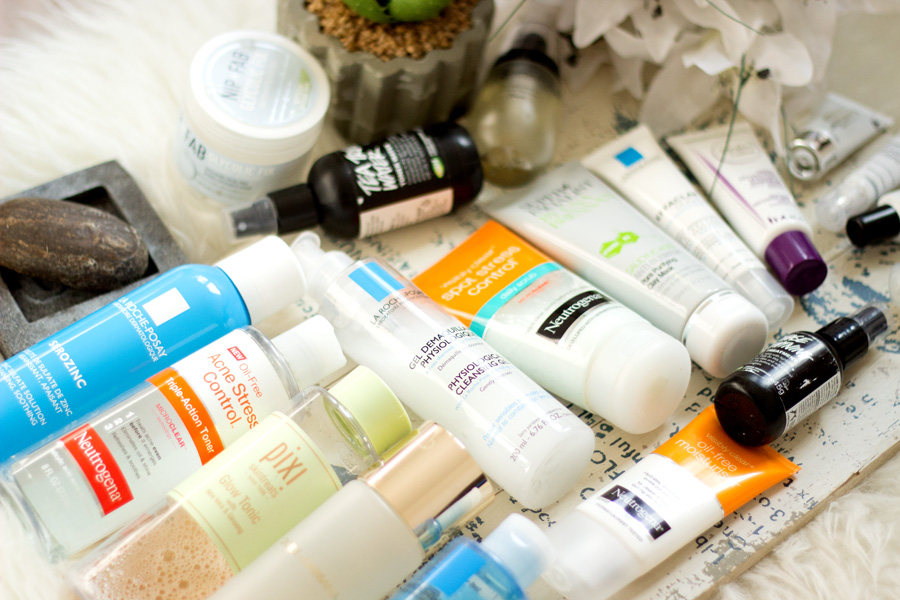
Image resolution: width=900 pixels, height=600 pixels. Find the location of `empty bottle`. empty bottle is located at coordinates (526, 126).